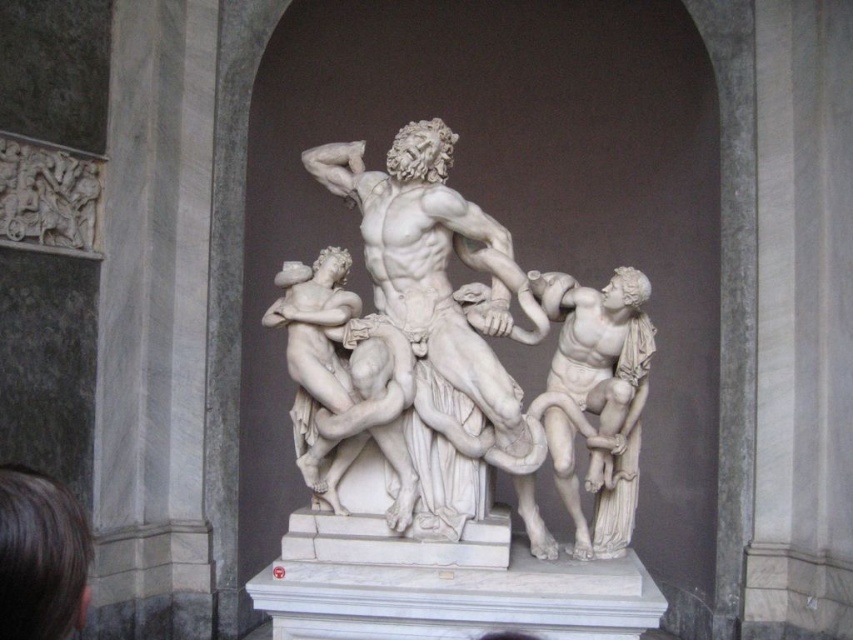
Question: Observing the image, what is the correct spatial positioning of white marble sculpture at center in reference to white marble statue at right?

Choices:
 (A) above
 (B) below

Answer: (A)

Question: Which point is closer to the camera taking this photo?

Choices:
 (A) (612, 355)
 (B) (611, 305)

Answer: (B)

Question: Is white marble sculpture at center behind white marble statue at right?

Choices:
 (A) no
 (B) yes

Answer: (A)

Question: Is white marble sculpture at center to the left of white marble statue at right from the viewer's perspective?

Choices:
 (A) yes
 (B) no

Answer: (A)